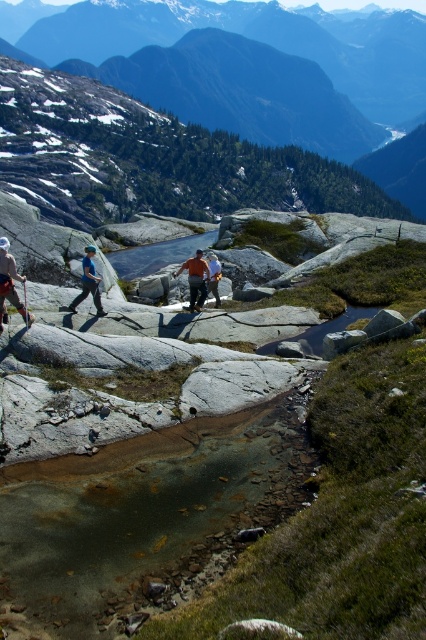
Does point (195, 304) come in front of point (100, 305)?

No, (195, 304) is behind (100, 305).

In the scene shown: How much distance is there between orange shirt at center and blue fabric pants at center?

orange shirt at center is 5.59 meters away from blue fabric pants at center.

Which is behind, point (195, 305) or point (86, 268)?

The point (195, 305) is behind.

The image size is (426, 640). I want to click on orange shirt at center, so click(195, 280).

Where is `green grassy mountain at upper center`? Image resolution: width=426 pixels, height=640 pixels. green grassy mountain at upper center is located at coordinates (270, 45).

Who is taller, green grassy mountain at upper center or blue fabric pants at center?

green grassy mountain at upper center

Is point (347, 29) closer to camera compared to point (91, 262)?

No, (347, 29) is further to viewer.

Identify the location of green grassy mountain at upper center. The width and height of the screenshot is (426, 640). (270, 45).

Between point (26, 317) and point (85, 272), which one is positioned behind?

Point (85, 272)

The image size is (426, 640). Identify the location of matte blue jacket at left. (9, 284).